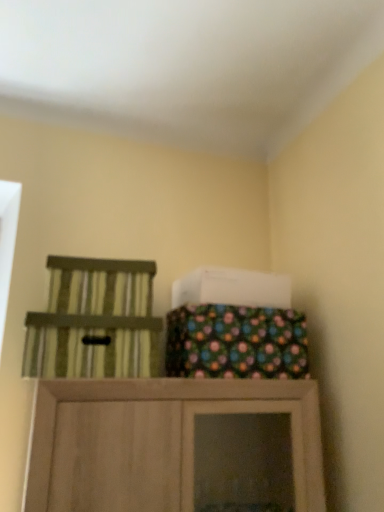
Question: Is green striped chair at left completely or partially outside of polka dot fabric bag at upper center?

Choices:
 (A) yes
 (B) no

Answer: (A)

Question: Is green striped chair at left to the right of polka dot fabric bag at upper center from the viewer's perspective?

Choices:
 (A) yes
 (B) no

Answer: (B)

Question: Considering the relative sizes of green striped chair at left and polka dot fabric bag at upper center in the image provided, is green striped chair at left taller than polka dot fabric bag at upper center?

Choices:
 (A) yes
 (B) no

Answer: (B)

Question: From a real-world perspective, is green striped chair at left located beneath polka dot fabric bag at upper center?

Choices:
 (A) yes
 (B) no

Answer: (A)

Question: From a real-world perspective, is green striped chair at left over polka dot fabric bag at upper center?

Choices:
 (A) no
 (B) yes

Answer: (A)

Question: Is green striped chair at left looking in the opposite direction of polka dot fabric bag at upper center?

Choices:
 (A) no
 (B) yes

Answer: (A)

Question: Is polka dot fabric bag at upper center looking in the opposite direction of green striped chair at left?

Choices:
 (A) yes
 (B) no

Answer: (B)

Question: From a real-world perspective, is polka dot fabric bag at upper center physically above green striped chair at left?

Choices:
 (A) no
 (B) yes

Answer: (B)

Question: Is polka dot fabric bag at upper center facing towards green striped chair at left?

Choices:
 (A) yes
 (B) no

Answer: (B)

Question: Does polka dot fabric bag at upper center have a lesser height compared to green striped chair at left?

Choices:
 (A) yes
 (B) no

Answer: (B)

Question: From the image's perspective, is polka dot fabric bag at upper center above green striped chair at left?

Choices:
 (A) no
 (B) yes

Answer: (B)

Question: From a real-world perspective, is polka dot fabric bag at upper center positioned under green striped chair at left based on gravity?

Choices:
 (A) no
 (B) yes

Answer: (A)

Question: Would you say green striped chair at left is to the left or to the right of polka dot fabric bag at upper center in the picture?

Choices:
 (A) left
 (B) right

Answer: (A)